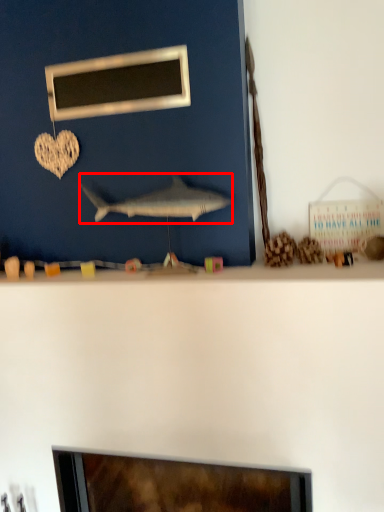
Question: From the image's perspective, what is the correct spatial relationship of fish (annotated by the red box) in relation to picture frame?

Choices:
 (A) above
 (B) below

Answer: (B)